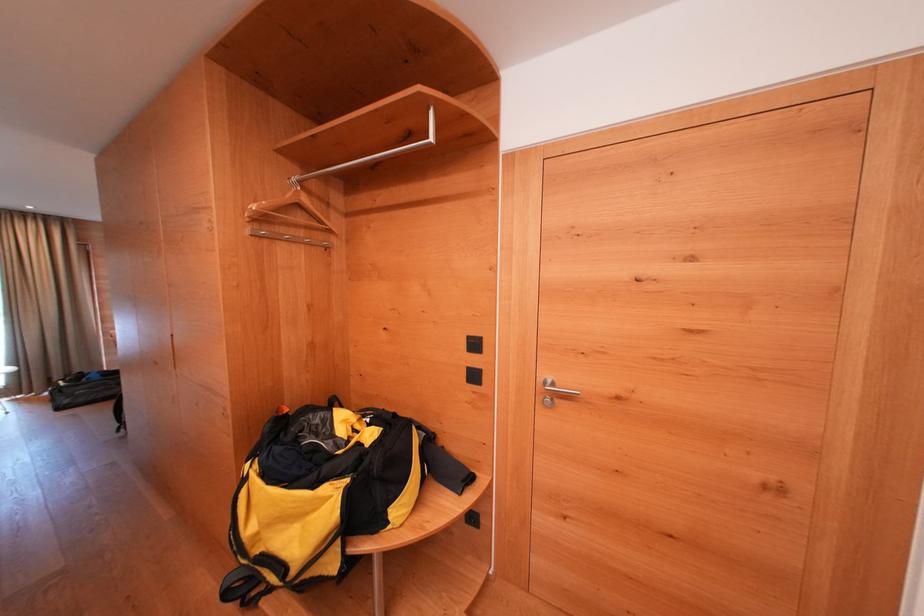
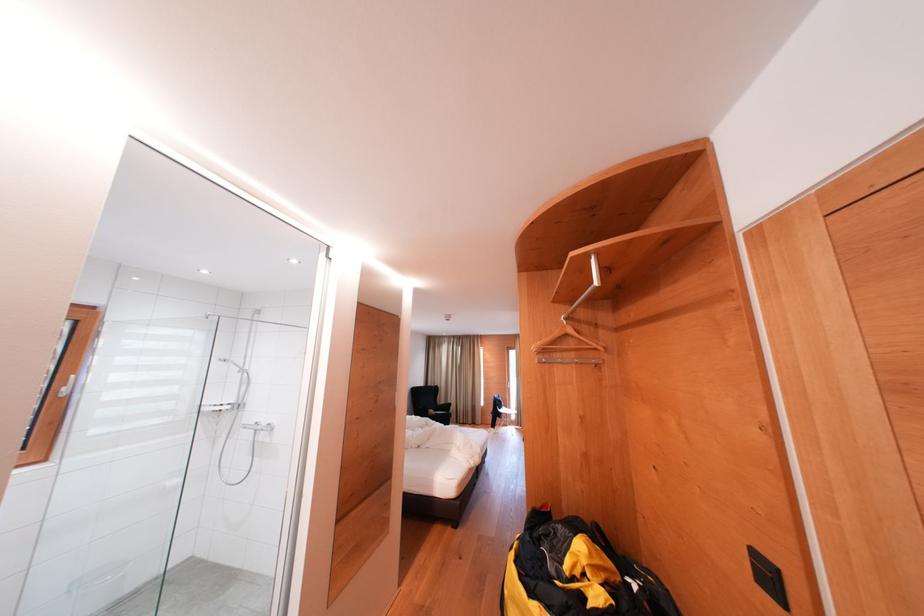
Find the pixel in the second image that matches pixel 308 237 in the first image.

(579, 359)